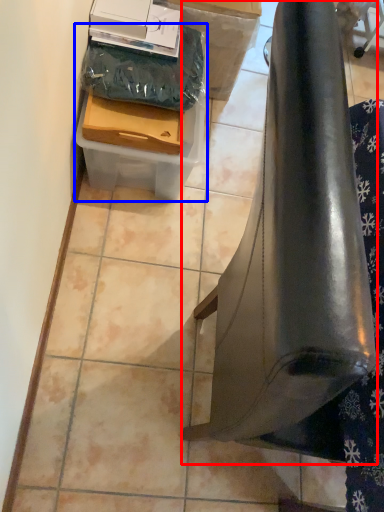
Question: Which point is closer to the camera, furniture (highlighted by a red box) or box (highlighted by a blue box)?

Choices:
 (A) furniture
 (B) box

Answer: (A)